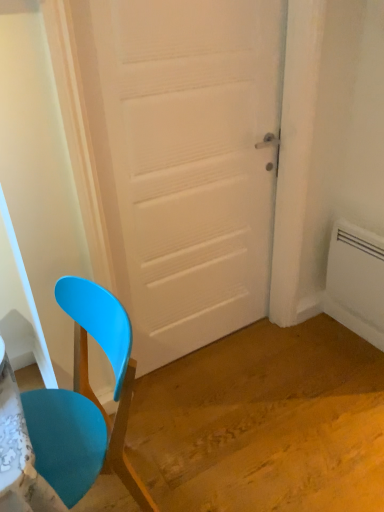
Question: In the image, is matte plastic chair at left positioned in front of or behind white matte door at center?

Choices:
 (A) front
 (B) behind

Answer: (A)

Question: Would you say matte plastic chair at left is to the left or to the right of white matte door at center in the picture?

Choices:
 (A) left
 (B) right

Answer: (A)

Question: Which object is positioned closest to the matte plastic chair at left?

Choices:
 (A) white matte door at center
 (B) white plastic radiator at right

Answer: (A)

Question: Estimate the real-world distances between objects in this image. Which object is farther from the white plastic radiator at right?

Choices:
 (A) white matte door at center
 (B) matte plastic chair at left

Answer: (B)